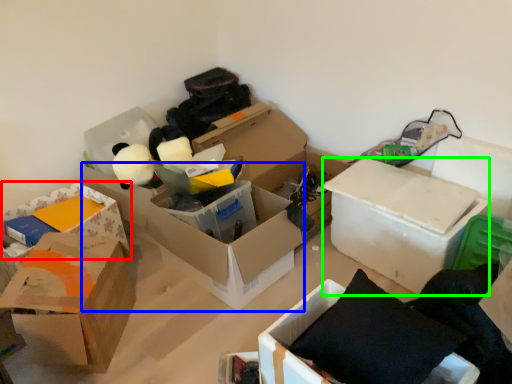
Question: Based on their relative distances, which object is farther from box (highlighted by a red box)? Choose from box (highlighted by a blue box) and box (highlighted by a green box).

Choices:
 (A) box
 (B) box

Answer: (B)